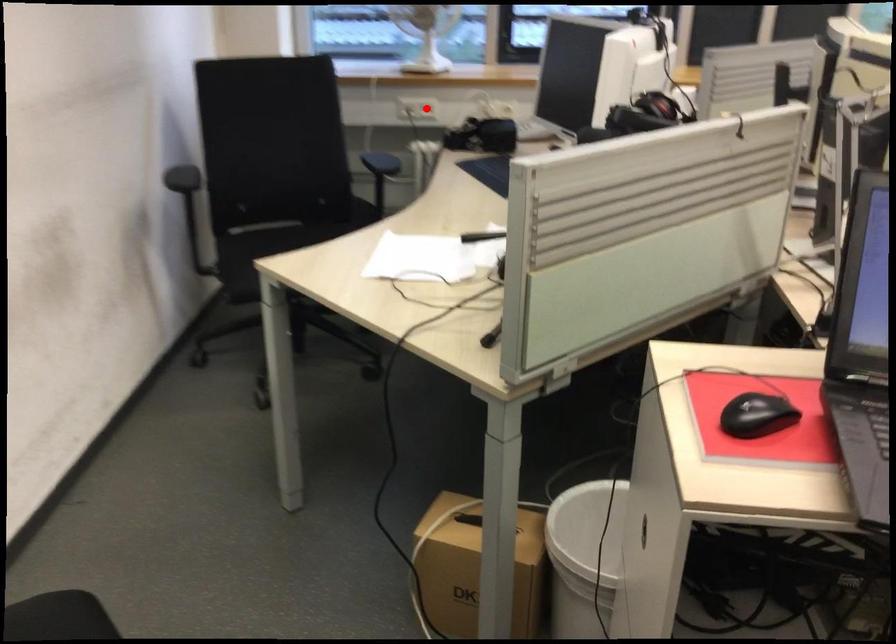
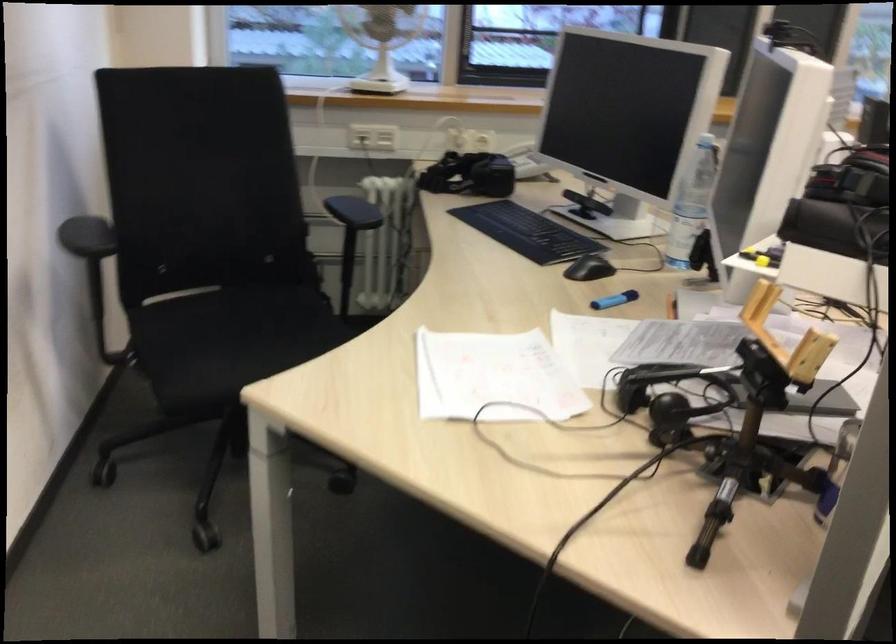
Question: I am providing you with two images of the same scene from different viewpoints. Image1 has a red point marked. In image2, the corresponding 3D location appears at what relative position? Reply with the corresponding letter.

Choices:
 (A) Closer
 (B) Farther

Answer: (A)